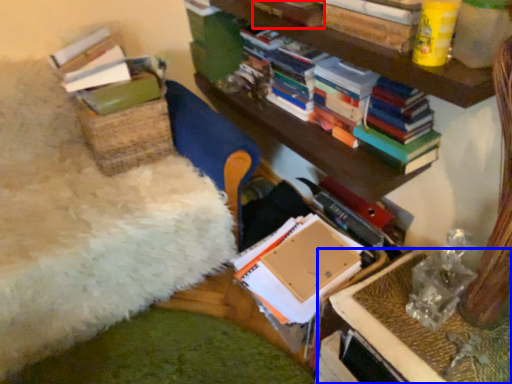
Question: Which point is closer to the camera, book (highlighted by a red box) or table (highlighted by a blue box)?

Choices:
 (A) book
 (B) table

Answer: (B)